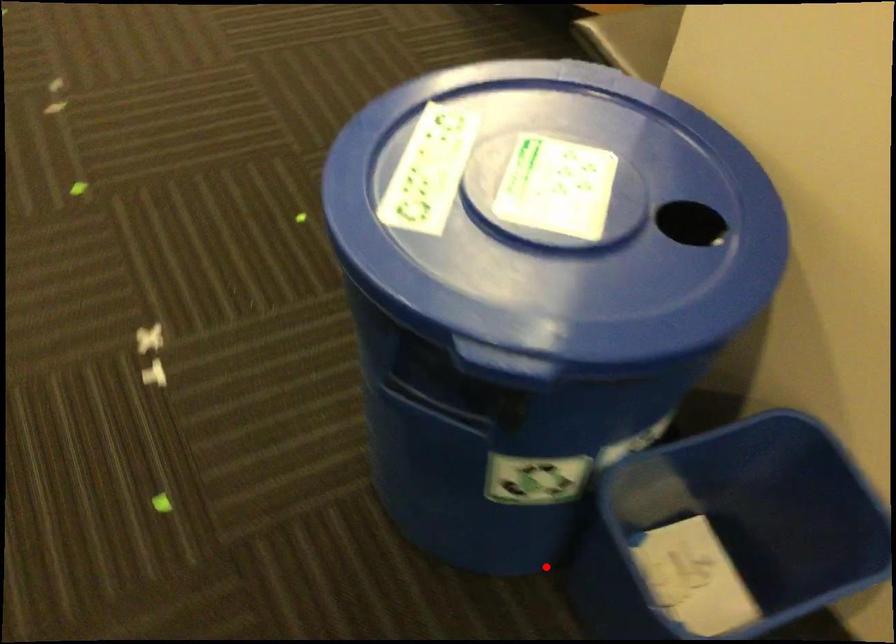
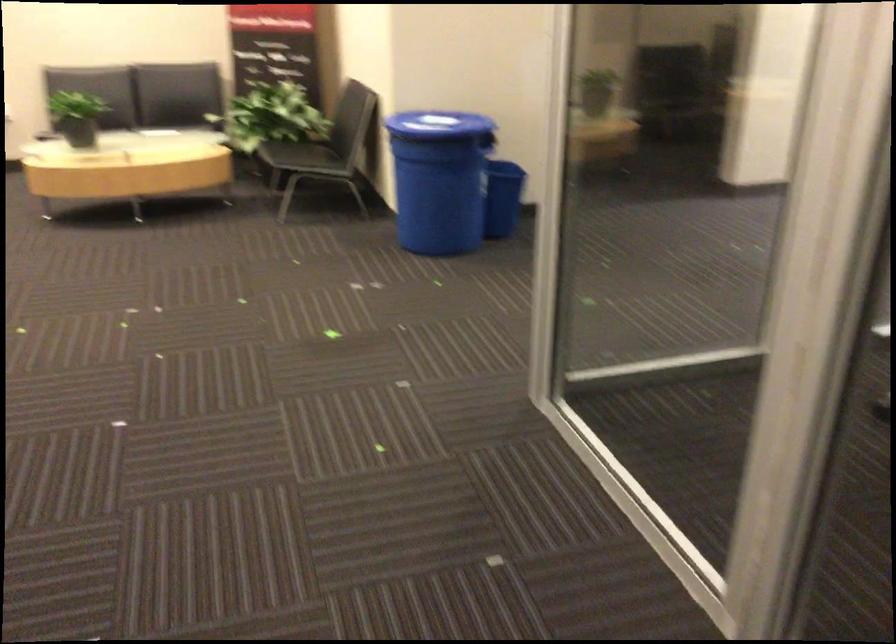
The point at the highlighted location is marked in the first image. Where is the corresponding point in the second image?

(502, 198)